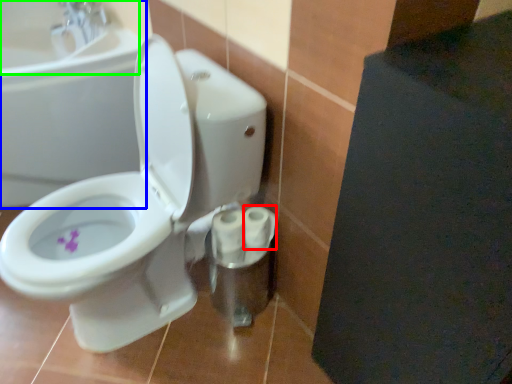
Question: Based on their relative distances, which object is nearer to toilet paper (highlighted by a red box)? Choose from bath (highlighted by a blue box) and sink (highlighted by a green box).

Choices:
 (A) bath
 (B) sink

Answer: (A)